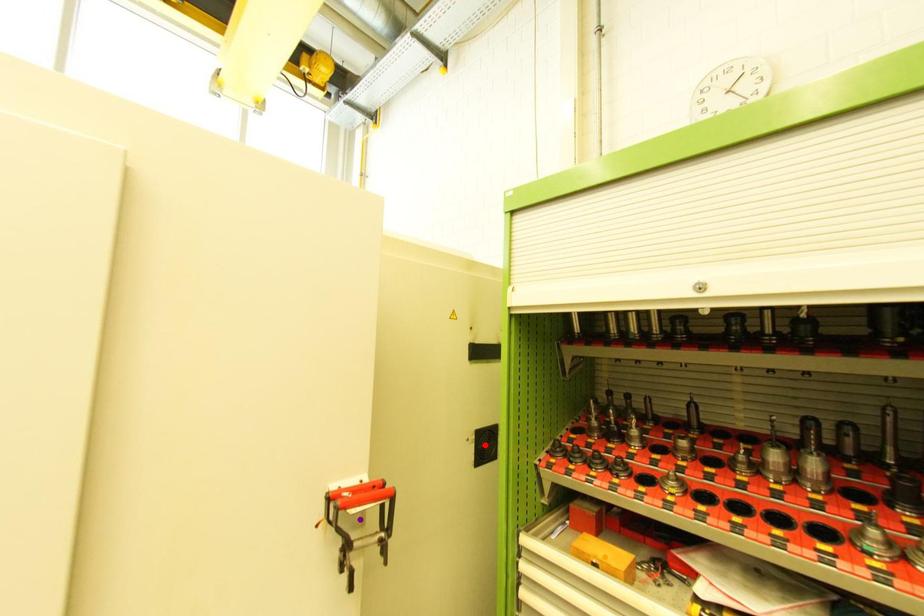
Consider the image. Order these from nearest to farthest:
A) orange point
B) red point
C) purple point

red point → orange point → purple point